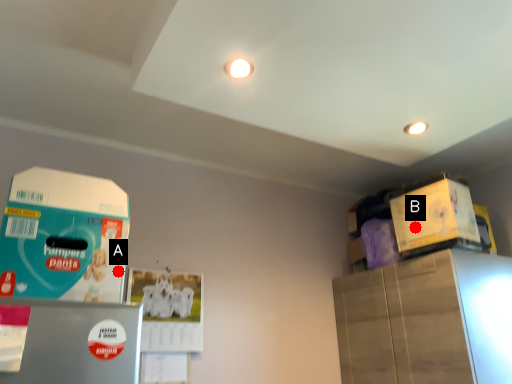
Question: Two points are circled on the image, labeled by A and B beside each circle. Which point appears closest to the camera in this image?

Choices:
 (A) A is closer
 (B) B is closer

Answer: (A)